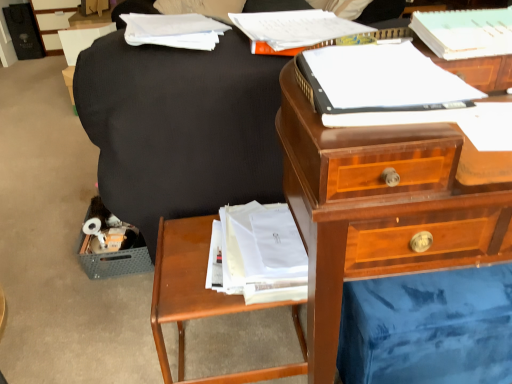
Question: Is wooden nightstand at lower left completely or partially inside white paper at upper center, marked as the 3th paperback book in a front-to-back arrangement?

Choices:
 (A) no
 (B) yes

Answer: (A)

Question: Considering the relative sizes of white paper at upper center, placed as the 1th paperback book when sorted from back to front, and wooden nightstand at lower left in the image provided, is white paper at upper center, placed as the 1th paperback book when sorted from back to front, shorter than wooden nightstand at lower left?

Choices:
 (A) no
 (B) yes

Answer: (B)

Question: Can you see white paper at upper center, placed as the 1th paperback book when sorted from back to front, touching wooden nightstand at lower left?

Choices:
 (A) no
 (B) yes

Answer: (A)

Question: Is there a large distance between white paper at upper center, marked as the 3th paperback book in a front-to-back arrangement, and wooden nightstand at lower left?

Choices:
 (A) no
 (B) yes

Answer: (A)

Question: Is white paper at upper center, placed as the 1th paperback book when sorted from back to front, looking in the opposite direction of wooden nightstand at lower left?

Choices:
 (A) yes
 (B) no

Answer: (B)

Question: In terms of width, does white paper at upper left look wider or thinner when compared to white paper at upper center, marked as the 3th paperback book in a front-to-back arrangement?

Choices:
 (A) wide
 (B) thin

Answer: (A)

Question: Is white paper at upper left bigger or smaller than white paper at upper center, placed as the 1th paperback book when sorted from back to front?

Choices:
 (A) big
 (B) small

Answer: (B)

Question: Does point (130, 14) appear closer or farther from the camera than point (258, 49)?

Choices:
 (A) farther
 (B) closer

Answer: (A)

Question: From the image's perspective, is white paper at upper left positioned above or below white paper at upper center, marked as the 3th paperback book in a front-to-back arrangement?

Choices:
 (A) below
 (B) above

Answer: (B)

Question: Is white paper at upper center, placed as the 1th paperback book when sorted from back to front, taller or shorter than matte black file cabinet at upper left?

Choices:
 (A) short
 (B) tall

Answer: (A)

Question: Is white paper at upper center, placed as the 1th paperback book when sorted from back to front, spatially inside matte black file cabinet at upper left, or outside of it?

Choices:
 (A) outside
 (B) inside

Answer: (A)

Question: Would you say white paper at upper center, placed as the 1th paperback book when sorted from back to front, is to the left or to the right of matte black file cabinet at upper left in the picture?

Choices:
 (A) left
 (B) right

Answer: (B)

Question: Considering the positions of white paper at upper center, marked as the 3th paperback book in a front-to-back arrangement, and matte black file cabinet at upper left in the image, is white paper at upper center, marked as the 3th paperback book in a front-to-back arrangement, wider or thinner than matte black file cabinet at upper left?

Choices:
 (A) thin
 (B) wide

Answer: (A)

Question: Is white paper at upper left in front of or behind matte black file cabinet at upper left in the image?

Choices:
 (A) front
 (B) behind

Answer: (A)

Question: Is white paper at upper left bigger or smaller than matte black file cabinet at upper left?

Choices:
 (A) small
 (B) big

Answer: (A)